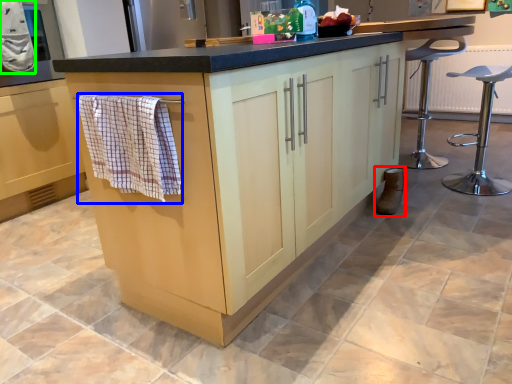
Question: Which is farther away from footwear (highlighted by a red box)? bath towel (highlighted by a blue box) or bath towel (highlighted by a green box)?

Choices:
 (A) bath towel
 (B) bath towel

Answer: (B)